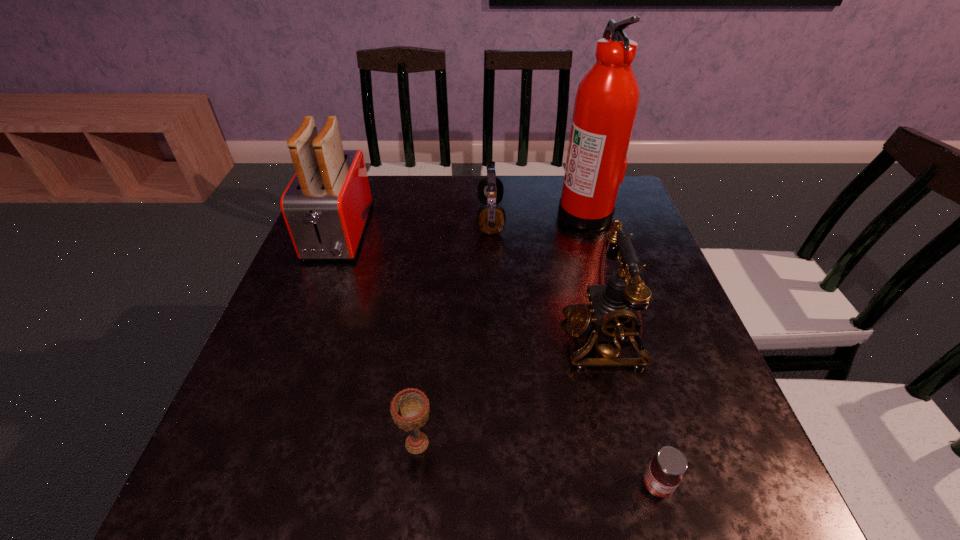
The image size is (960, 540). I want to click on free space between the headset and the shortest object, so click(x=574, y=352).

Find the location of a particular element. This screenshot has height=540, width=960. free point between the fourth farthest object and the second object from left to right is located at coordinates (511, 391).

The width and height of the screenshot is (960, 540). What are the coordinates of `unoccupied position between the leftmost object and the telephone` in the screenshot? It's located at (470, 286).

What are the coordinates of `free space between the jam and the second tallest object` in the screenshot? It's located at (497, 360).

The height and width of the screenshot is (540, 960). What are the coordinates of `free space between the second nearest object and the jam` in the screenshot? It's located at (537, 464).

At what (x,y) coordinates should I click in order to perform the action: click on free point between the second shortest object and the second tallest object. Please return your answer as a coordinate pair (x, y). Looking at the image, I should click on [x=377, y=339].

Image resolution: width=960 pixels, height=540 pixels. Identify the location of empty space between the second nearest object and the second tallest object. (377, 339).

At what (x,y) coordinates should I click in order to perform the action: click on object that is the closest one to the third object from left to right. Please return your answer as a coordinate pair (x, y). Looking at the image, I should click on (607, 99).

Where is `object that ranks as the fourth closest to the chalice`? The height and width of the screenshot is (540, 960). object that ranks as the fourth closest to the chalice is located at coordinates (491, 217).

I want to click on blank area in the image that satisfies the following two spatial constraints: 1. on the label side of the tallest object; 2. on the front-facing side of the leftmost object, so click(x=590, y=234).